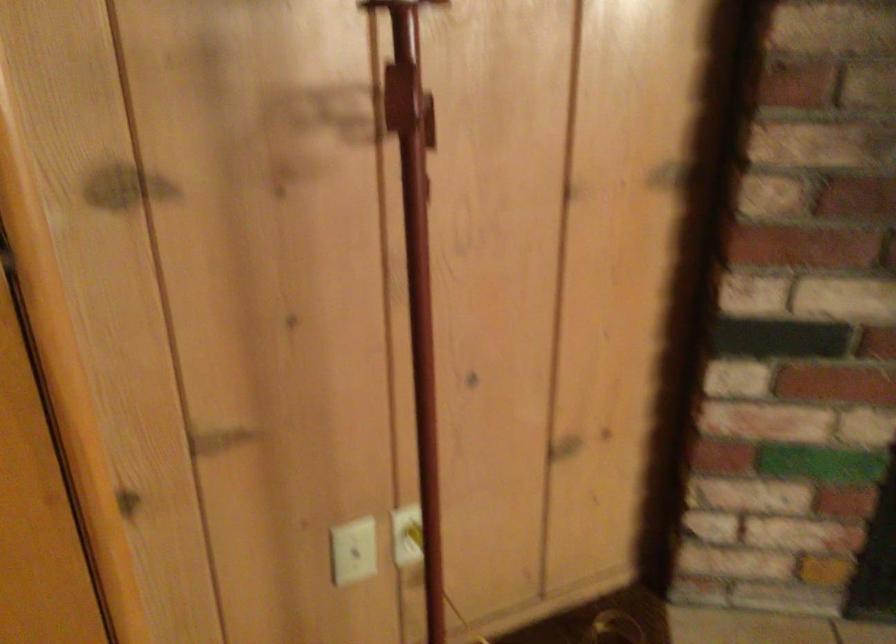
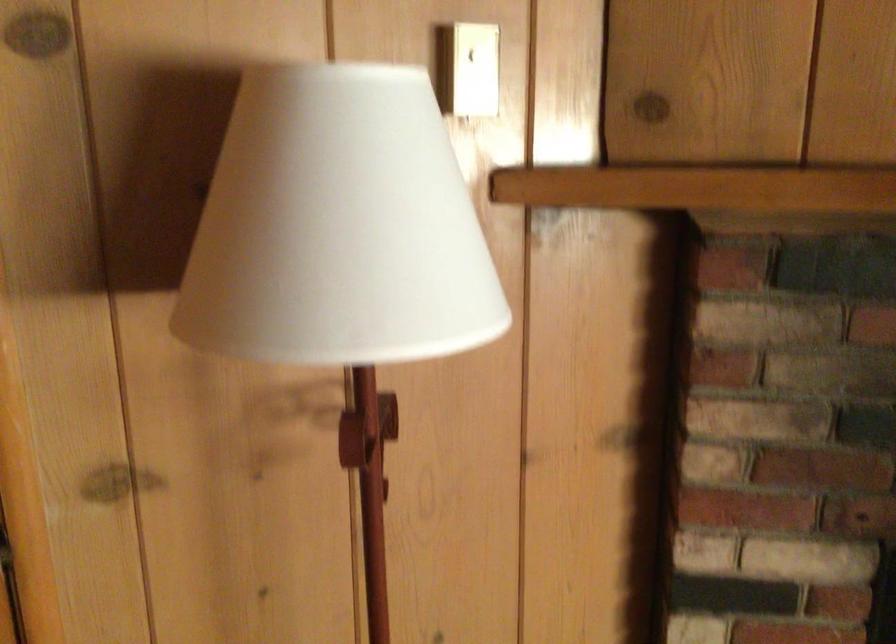
Looking at this image, what movement of the cameraman would produce the second image?

The movement direction of the cameraman is right, backward.